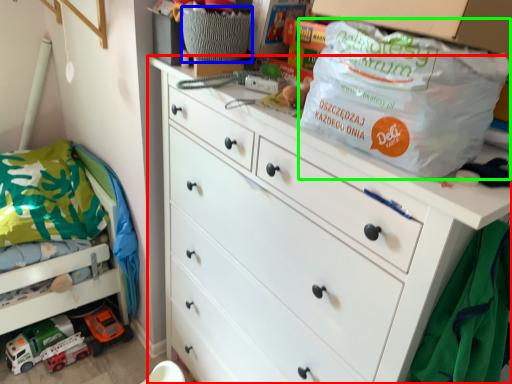
Question: Considering the real-world distances, which object is closest to chest of drawers (highlighted by a red box)? basket (highlighted by a blue box) or bag (highlighted by a green box).

Choices:
 (A) basket
 (B) bag

Answer: (B)